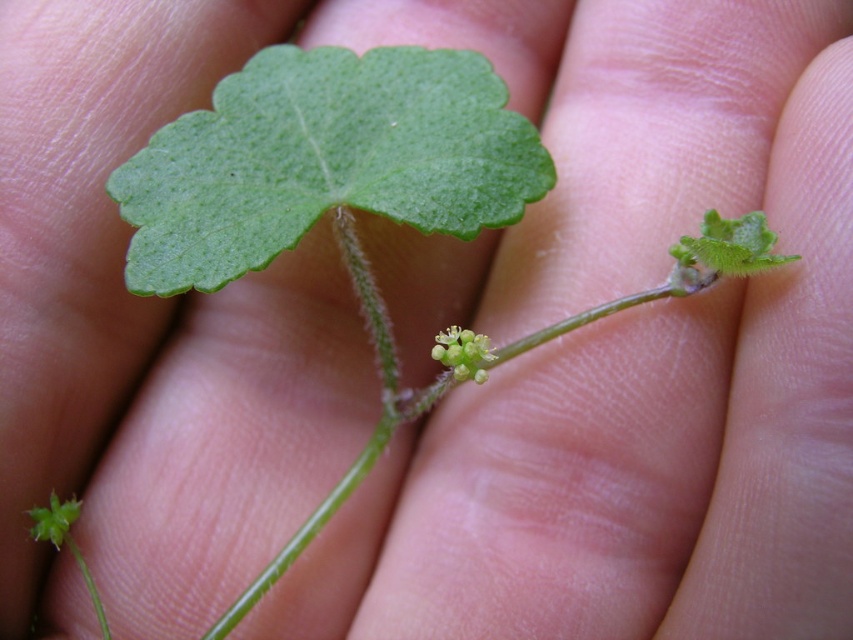
You are holding a plant with a green matte leaf at center and a green matte flower at center. Which part of the plant is larger?

The green matte leaf at center is bigger than the green matte flower at center.

You are a botanist examining a plant through a magnifying glass. You notice the green matte leaf at center and the green matte flower at center. Which one is closer to your magnifying glass?

The green matte leaf at center is closer to the magnifying glass because it is further to the viewer than the green matte flower at center.